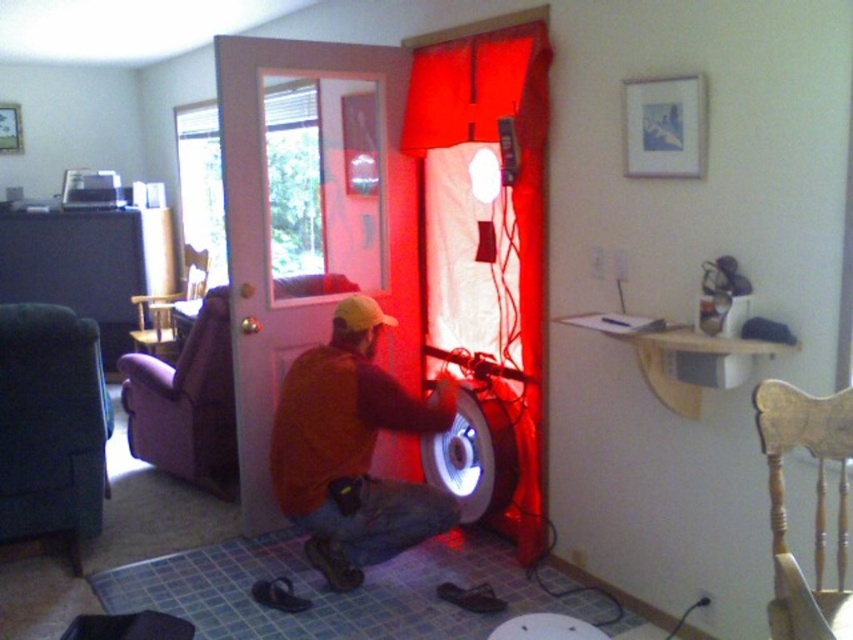
Which is below, brown suede jacket at center or red fabric curtain at center?

Positioned lower is brown suede jacket at center.

Who is higher up, brown suede jacket at center or red fabric curtain at center?

Positioned higher is red fabric curtain at center.

Is point (289, 396) behind point (544, 134)?

No, it is in front of (544, 134).

Where is `brown suede jacket at center`? The width and height of the screenshot is (853, 640). brown suede jacket at center is located at coordinates (352, 451).

Does white glossy door at center appear on the right side of red fabric curtain at center?

No, white glossy door at center is not to the right of red fabric curtain at center.

You are a GUI agent. You are given a task and a screenshot of the screen. Output one action in this format:
    pyautogui.click(x=<x>, y=<y>)
    Task: Click on the white glossy door at center
    The image size is (853, 640).
    Given the screenshot: What is the action you would take?
    pyautogui.click(x=270, y=237)

Is point (253, 316) positioned after point (372, 356)?

Yes, point (253, 316) is farther from viewer.

Image resolution: width=853 pixels, height=640 pixels. In order to click on white glossy door at center in this screenshot , I will do `click(270, 237)`.